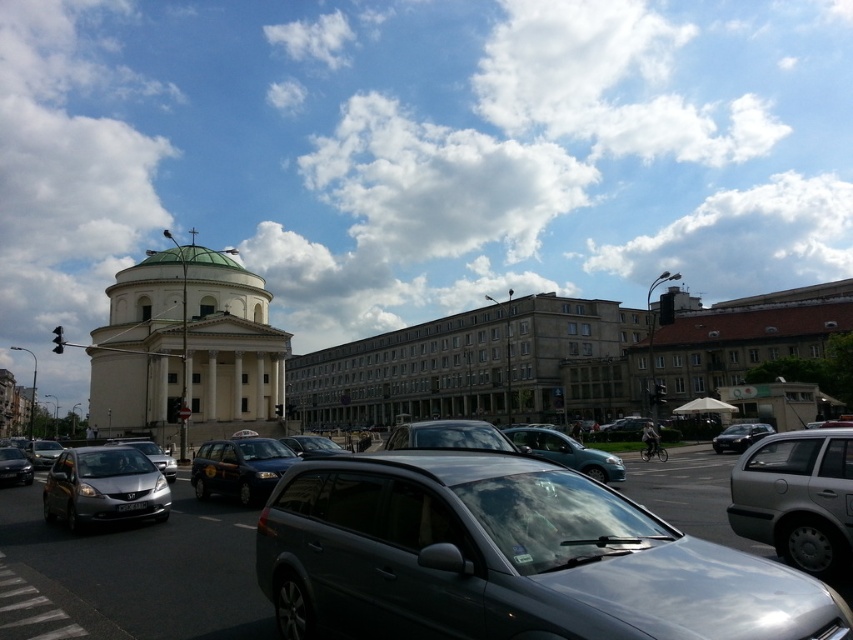
You are a pedestrian standing at the intersection and see the silver metallic car at right and the metallic silver car at center. Which car is located more to the right side of the intersection?

The silver metallic car at right is positioned on the right side of the metallic silver car at center, so it is more to the right side of the intersection.

You are standing at the center of the intersection and see the silver metallic car at right. Which direction should you walk to reach it?

Since the silver metallic car at right is located at point (798,499), you should walk towards the right side of the intersection to reach it.

You are a delivery driver who needs to park your silver metallic hatchback at lower left in a designated parking spot located at point [103,486]. Can you safely park there without blocking the traffic intersection?

The point [103,486] marks the silver metallic hatchback at lower left, so parking there would mean parking on the traffic intersection, which is not allowed. Please choose a different parking spot away from the intersection.